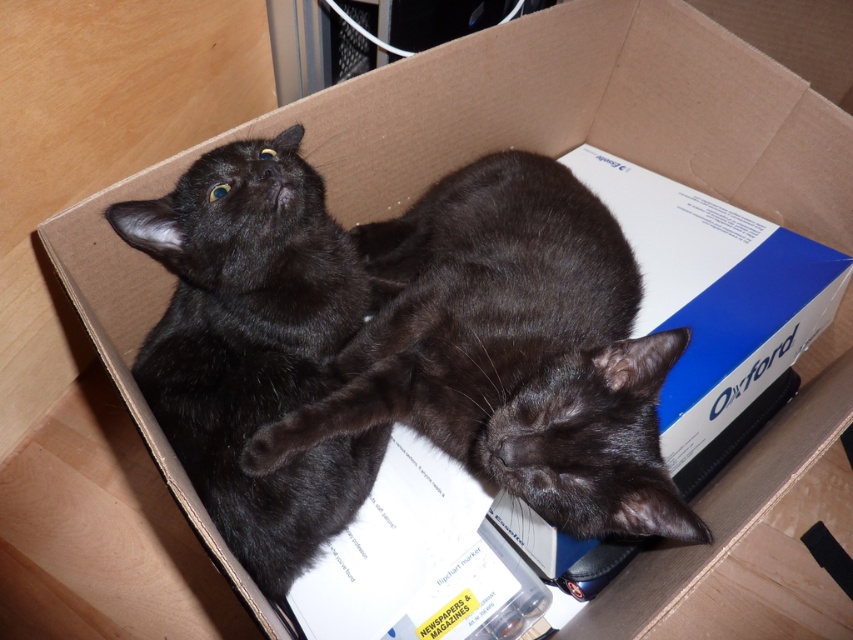
Does point (689, 509) lie behind point (141, 384)?

No, it is in front of (141, 384).

Can you confirm if black fur cat at center is thinner than black fur cat at upper left?

No.

You are a GUI agent. You are given a task and a screenshot of the screen. Output one action in this format:
    pyautogui.click(x=<x>, y=<y>)
    Task: Click on the black fur cat at center
    The width and height of the screenshot is (853, 640).
    Given the screenshot: What is the action you would take?
    pyautogui.click(x=511, y=349)

Find the location of a particular element. The width and height of the screenshot is (853, 640). black fur cat at center is located at coordinates (511, 349).